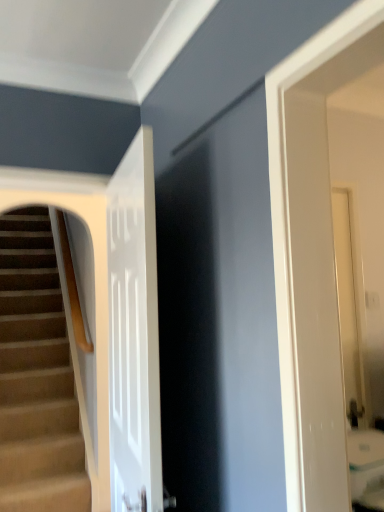
Question: Relative to carpeted stairs at left, is white glossy door at center in front or behind?

Choices:
 (A) front
 (B) behind

Answer: (A)

Question: From the image's perspective, is white glossy door at center above or below carpeted stairs at left?

Choices:
 (A) above
 (B) below

Answer: (A)

Question: Does point [137, 157] appear closer or farther from the camera than point [4, 501]?

Choices:
 (A) farther
 (B) closer

Answer: (B)

Question: Would you say carpeted stairs at left is to the left or to the right of white glossy door at center in the picture?

Choices:
 (A) right
 (B) left

Answer: (B)

Question: From a real-world perspective, relative to white glossy door at center, is carpeted stairs at left vertically above or below?

Choices:
 (A) above
 (B) below

Answer: (B)

Question: From the image's perspective, is carpeted stairs at left located above or below white glossy door at center?

Choices:
 (A) below
 (B) above

Answer: (A)

Question: Is carpeted stairs at left inside or outside of white glossy door at center?

Choices:
 (A) outside
 (B) inside

Answer: (A)